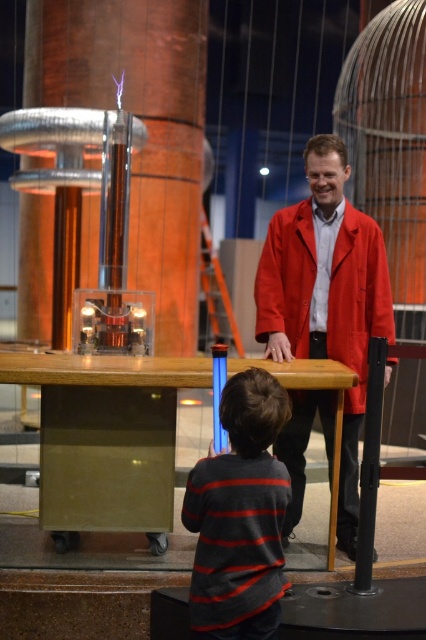
Question: Among these points, which one is nearest to the camera?

Choices:
 (A) (273, 611)
 (B) (43, 406)

Answer: (A)

Question: Is the position of matte red coat at center more distant than that of striped sweater at center?

Choices:
 (A) yes
 (B) no

Answer: (A)

Question: Among these objects, which one is nearest to the camera?

Choices:
 (A) matte red coat at center
 (B) striped sweater at center
 (C) wooden table at center

Answer: (B)

Question: Among these points, which one is farthest from the camera?

Choices:
 (A) (348, 428)
 (B) (229, 520)
 (C) (126, 442)

Answer: (A)

Question: Is matte red coat at center thinner than striped sweater at center?

Choices:
 (A) no
 (B) yes

Answer: (A)

Question: Is matte red coat at center to the left of striped sweater at center from the viewer's perspective?

Choices:
 (A) no
 (B) yes

Answer: (A)